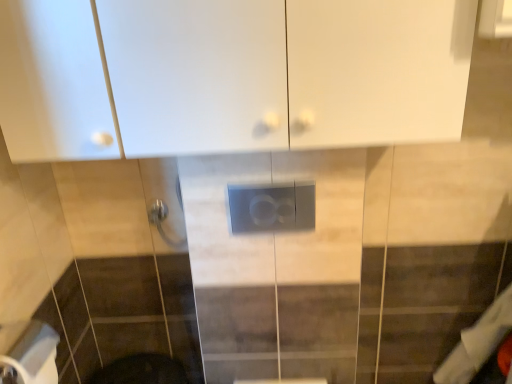
Question: From the image's perspective, would you say satin gray panel at center is shown under white matte toilet paper at lower left?

Choices:
 (A) no
 (B) yes

Answer: (A)

Question: Is satin gray panel at center located outside white matte toilet paper at lower left?

Choices:
 (A) yes
 (B) no

Answer: (A)

Question: Is satin gray panel at center further to the viewer compared to white matte toilet paper at lower left?

Choices:
 (A) no
 (B) yes

Answer: (B)

Question: Is satin gray panel at center oriented away from white matte toilet paper at lower left?

Choices:
 (A) yes
 (B) no

Answer: (B)

Question: Is satin gray panel at center at the left side of white matte toilet paper at lower left?

Choices:
 (A) no
 (B) yes

Answer: (A)

Question: From a real-world perspective, is satin gray panel at center physically above white matte toilet paper at lower left?

Choices:
 (A) yes
 (B) no

Answer: (A)

Question: From the image's perspective, would you say satin gray panel at center is positioned over white glossy cabinet at upper center?

Choices:
 (A) no
 (B) yes

Answer: (A)

Question: Is the position of satin gray panel at center more distant than that of white glossy cabinet at upper center?

Choices:
 (A) yes
 (B) no

Answer: (A)

Question: Is satin gray panel at center smaller than white glossy cabinet at upper center?

Choices:
 (A) no
 (B) yes

Answer: (B)

Question: Can you confirm if satin gray panel at center is shorter than white glossy cabinet at upper center?

Choices:
 (A) no
 (B) yes

Answer: (B)

Question: Is satin gray panel at center thinner than white glossy cabinet at upper center?

Choices:
 (A) no
 (B) yes

Answer: (B)

Question: Is satin gray panel at center taller than white glossy cabinet at upper center?

Choices:
 (A) no
 (B) yes

Answer: (A)

Question: Does white glossy cabinet at upper center have a lesser width compared to white matte toilet paper at lower left?

Choices:
 (A) no
 (B) yes

Answer: (A)